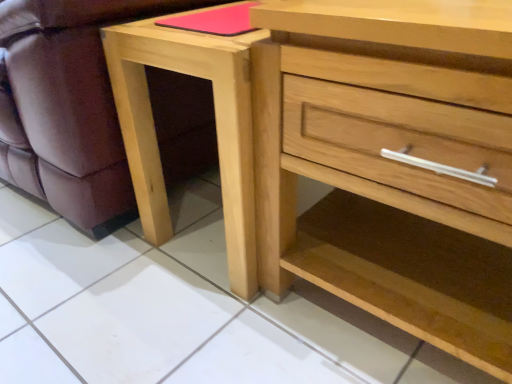
Question: Is natural wood chest of drawers at center in front of or behind natural wood nightstand at lower center in the image?

Choices:
 (A) behind
 (B) front

Answer: (B)

Question: From the image's perspective, is natural wood chest of drawers at center positioned above or below natural wood nightstand at lower center?

Choices:
 (A) above
 (B) below

Answer: (B)

Question: Which object is the closest to the natural wood nightstand at lower center?

Choices:
 (A) matte wood swivel chair at lower left
 (B) natural wood chest of drawers at center

Answer: (A)

Question: Which of these objects is positioned farthest from the matte wood swivel chair at lower left?

Choices:
 (A) natural wood nightstand at lower center
 (B) natural wood chest of drawers at center

Answer: (B)